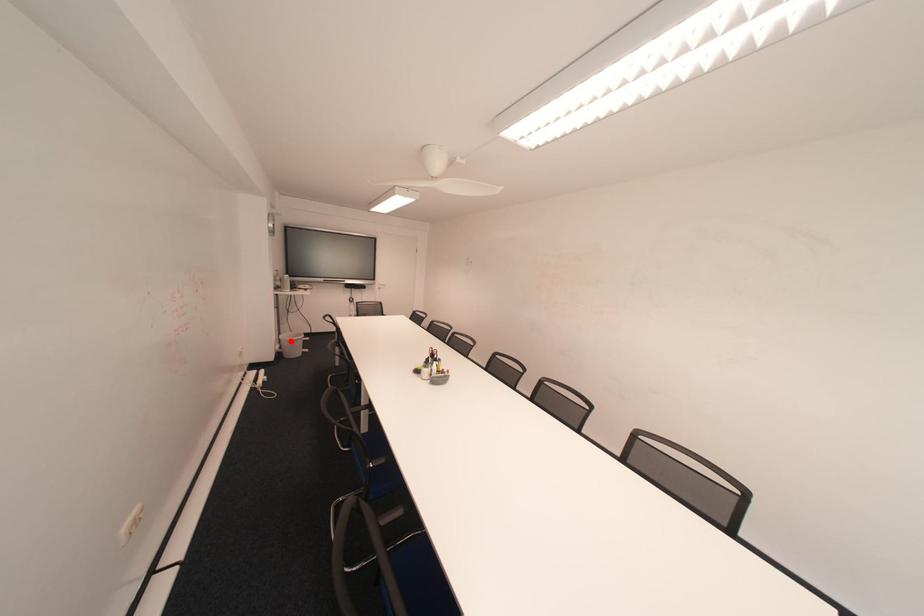
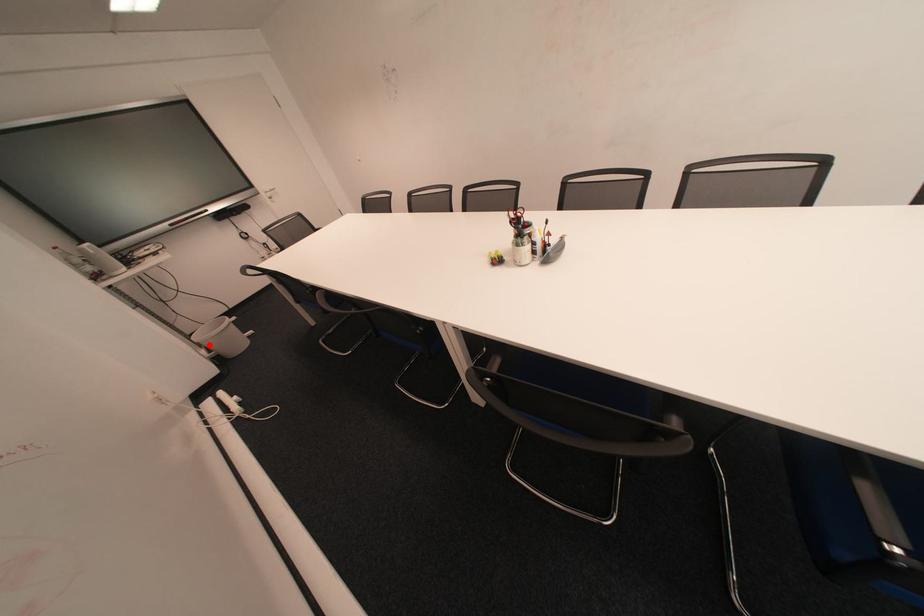
I am providing you with two images of the same scene from different viewpoints. A red point is marked on the first image and another point is marked on the second image. Is the red point in image1 aligned with the point shown in image2?

Yes